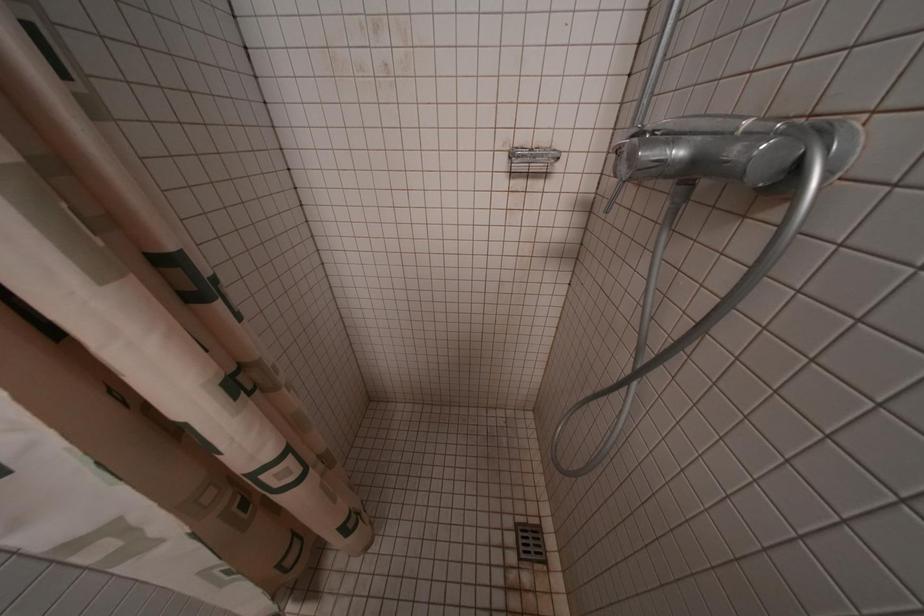
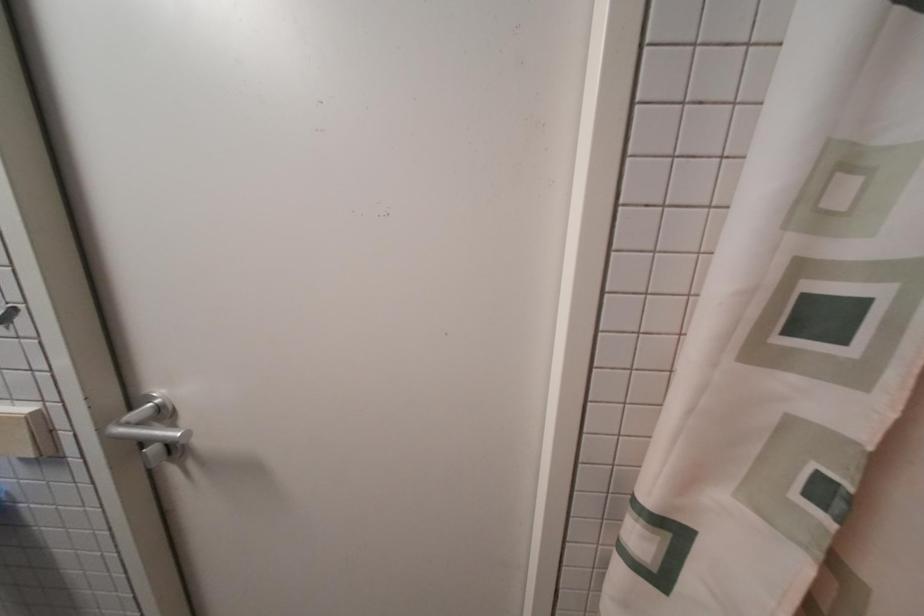
Question: The camera is either moving clockwise (left) or counter-clockwise (right) around the object. The first image is from the beginning of the video and the second image is from the end. Is the camera moving left or right when shooting the video?

Choices:
 (A) Left
 (B) Right

Answer: (B)